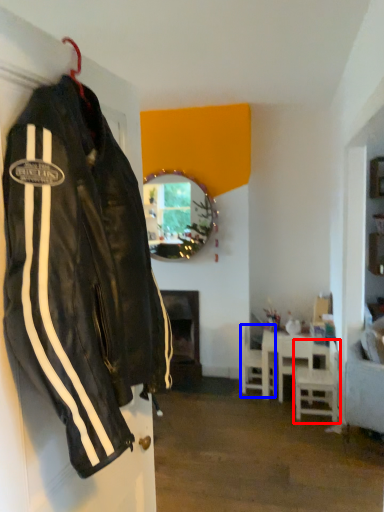
Question: Which point is further to the camera, chair (highlighted by a red box) or chair (highlighted by a blue box)?

Choices:
 (A) chair
 (B) chair

Answer: (B)